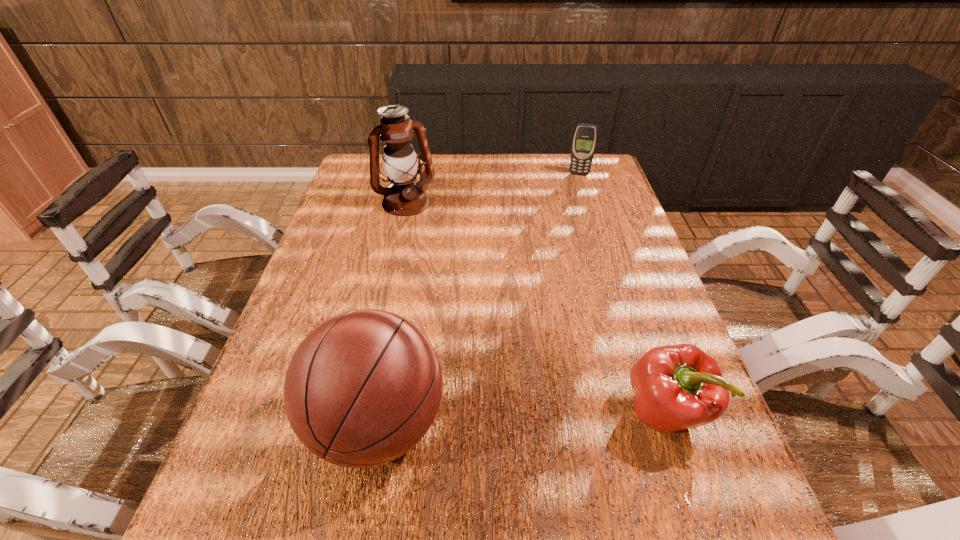
You are a GUI agent. You are given a task and a screenshot of the screen. Output one action in this format:
    pyautogui.click(x=<x>, y=<y>)
    Task: Click on the free spot between the cellular telephone and the pepper
    Image resolution: width=960 pixels, height=540 pixels.
    Given the screenshot: What is the action you would take?
    pyautogui.click(x=622, y=293)

This screenshot has width=960, height=540. I want to click on unoccupied area between the second tallest object and the cellular telephone, so click(478, 299).

Identify the location of free space between the third nearest object and the cellular telephone. (492, 188).

Locate an element on the screen. This screenshot has width=960, height=540. free space between the cellular telephone and the pepper is located at coordinates (622, 293).

The image size is (960, 540). I want to click on free space between the farthest object and the second tallest object, so click(478, 299).

Identify which object is the second closest to the second tallest object. Please provide its 2D coordinates. Your answer should be formatted as a tuple, i.e. [(x, y)], where the tuple contains the x and y coordinates of a point satisfying the conditions above.

[(405, 196)]

Select which object appears as the third closest to the farthest object. Please provide its 2D coordinates. Your answer should be formatted as a tuple, i.e. [(x, y)], where the tuple contains the x and y coordinates of a point satisfying the conditions above.

[(363, 388)]

Where is `blank space that satisfies the following two spatial constraints: 1. on the back side of the tallest object; 2. on the right side of the farthest object`? Image resolution: width=960 pixels, height=540 pixels. blank space that satisfies the following two spatial constraints: 1. on the back side of the tallest object; 2. on the right side of the farthest object is located at coordinates (412, 174).

Locate an element on the screen. This screenshot has height=540, width=960. vacant point that satisfies the following two spatial constraints: 1. on the back side of the basketball; 2. on the right side of the pepper is located at coordinates (380, 412).

Find the location of `free location that satisfies the following two spatial constraints: 1. on the front side of the third nearest object; 2. on the left side of the basketball`. free location that satisfies the following two spatial constraints: 1. on the front side of the third nearest object; 2. on the left side of the basketball is located at coordinates (356, 424).